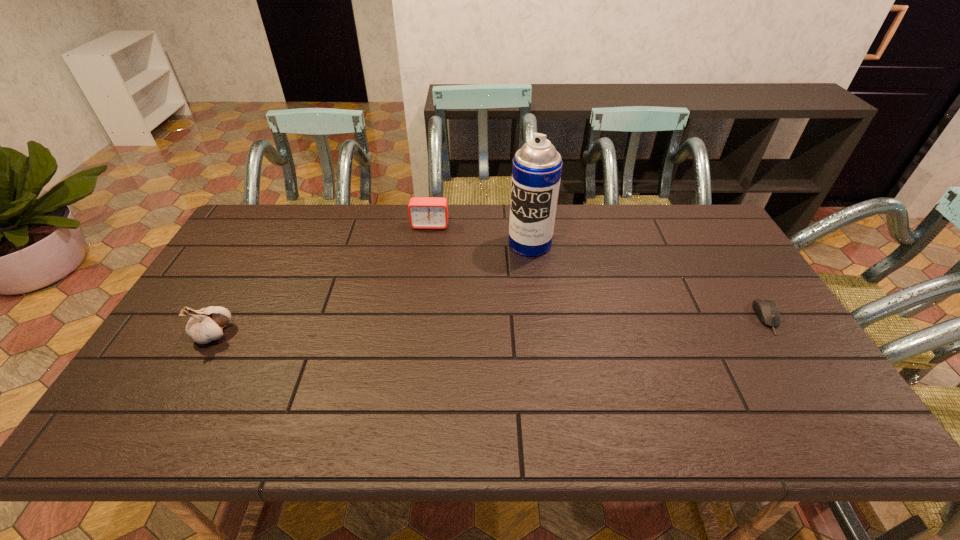
Locate an element on the screen. The width and height of the screenshot is (960, 540). vacant point at the far edge is located at coordinates (664, 244).

Locate an element on the screen. free spot at the left edge of the desktop is located at coordinates (218, 301).

This screenshot has height=540, width=960. In the image, there is a desktop. Identify the location of vacant space at the far left corner. (278, 226).

This screenshot has width=960, height=540. Identify the location of unoccupied position between the third tallest object and the computer mouse. (599, 271).

The image size is (960, 540). What are the coordinates of `unoccupied position between the garlic and the farthest object` in the screenshot? It's located at (322, 280).

Where is `vacant area that lies between the garlic and the second object from left to right`? The height and width of the screenshot is (540, 960). vacant area that lies between the garlic and the second object from left to right is located at coordinates [322, 280].

Identify the location of blank region between the aerosol can and the third object from right to left. (480, 234).

Where is `free spot between the second object from left to right and the leftmost object`? The height and width of the screenshot is (540, 960). free spot between the second object from left to right and the leftmost object is located at coordinates (322, 280).

Identify the location of vacant region between the third object from right to left and the tallest object. (480, 234).

Locate an element on the screen. empty space between the third object from left to right and the third object from right to left is located at coordinates (480, 234).